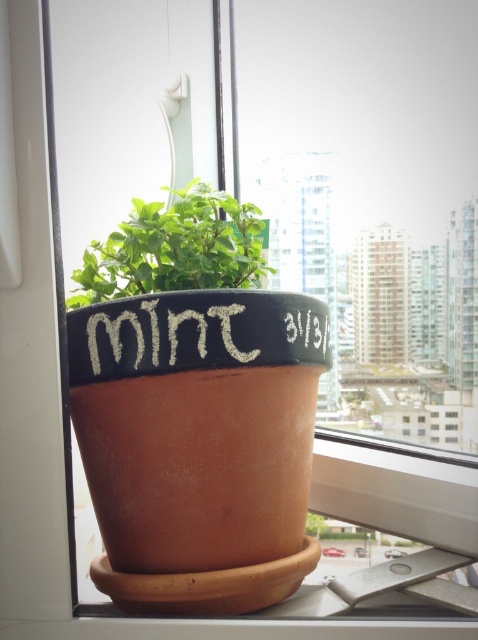
Question: Is green matte mint at center to the left of white chalk mint at center from the viewer's perspective?

Choices:
 (A) no
 (B) yes

Answer: (B)

Question: Which of the following is the farthest from the observer?

Choices:
 (A) green matte mint at center
 (B) white chalk mint at center

Answer: (A)

Question: Which point is closer to the camera?

Choices:
 (A) (159, 301)
 (B) (167, 216)

Answer: (A)

Question: Is green matte mint at center closer to camera compared to white chalk mint at center?

Choices:
 (A) yes
 (B) no

Answer: (B)

Question: Is green matte mint at center to the left of white chalk mint at center from the viewer's perspective?

Choices:
 (A) yes
 (B) no

Answer: (A)

Question: Which object is closer to the camera taking this photo?

Choices:
 (A) white chalk mint at center
 (B) green matte mint at center

Answer: (A)